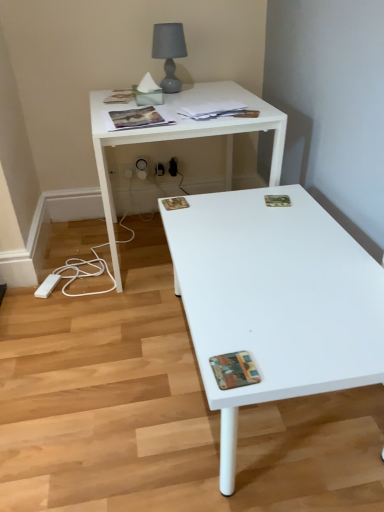
Question: Should I look upward or downward to see multicolored textured magazine at lower right, positioned as the 1th magazine in bottom-to-top order?

Choices:
 (A) up
 (B) down

Answer: (B)

Question: Is multicolored textured magazine at lower right, which ranks as the 6th magazine in back-to-front order, touching printed paper magazine at center, marked as the second magazine in a bottom-to-top arrangement?

Choices:
 (A) no
 (B) yes

Answer: (A)

Question: Can you confirm if multicolored textured magazine at lower right, acting as the first magazine starting from the front, is bigger than printed paper magazine at center, acting as the 3th magazine starting from the front?

Choices:
 (A) no
 (B) yes

Answer: (B)

Question: Does multicolored textured magazine at lower right, acting as the first magazine starting from the front, turn towards printed paper magazine at center, marked as the second magazine in a bottom-to-top arrangement?

Choices:
 (A) no
 (B) yes

Answer: (A)

Question: From a real-world perspective, is multicolored textured magazine at lower right, positioned as the 1th magazine in bottom-to-top order, beneath printed paper magazine at center, acting as the 3th magazine starting from the front?

Choices:
 (A) no
 (B) yes

Answer: (A)

Question: Is multicolored textured magazine at lower right, which ranks as the 6th magazine in back-to-front order, to the right of printed paper magazine at center, marked as the second magazine in a bottom-to-top arrangement, from the viewer's perspective?

Choices:
 (A) no
 (B) yes

Answer: (B)

Question: Is multicolored textured magazine at lower right, which ranks as the 6th magazine in back-to-front order, smaller than printed paper magazine at center, acting as the 3th magazine starting from the front?

Choices:
 (A) no
 (B) yes

Answer: (A)

Question: Is white plastic electric outlet at lower center, which is counted as the first electric outlet, starting from the left, in contact with printed paper magazine at upper center, which appears as the second magazine when viewed from the front?

Choices:
 (A) no
 (B) yes

Answer: (A)

Question: Is white plastic electric outlet at lower center, the second electric outlet positioned from the right, thinner than printed paper magazine at upper center, the third magazine positioned from the top?

Choices:
 (A) no
 (B) yes

Answer: (B)

Question: From a real-world perspective, is white plastic electric outlet at lower center, which is counted as the first electric outlet, starting from the left, below printed paper magazine at upper center, the third magazine positioned from the top?

Choices:
 (A) no
 (B) yes

Answer: (B)

Question: From the image's perspective, does white plastic electric outlet at lower center, which is counted as the first electric outlet, starting from the left, appear lower than printed paper magazine at upper center, the 5th magazine when ordered from back to front?

Choices:
 (A) yes
 (B) no

Answer: (A)

Question: Would you say white plastic electric outlet at lower center, which is counted as the first electric outlet, starting from the left, contains printed paper magazine at upper center, the 5th magazine when ordered from back to front?

Choices:
 (A) no
 (B) yes

Answer: (A)

Question: Does white plastic electric outlet at lower center, which is counted as the first electric outlet, starting from the left, have a smaller size compared to printed paper magazine at upper center, the 5th magazine when ordered from back to front?

Choices:
 (A) no
 (B) yes

Answer: (B)

Question: From a real-world perspective, is matte paper magazine at upper center, the fourth magazine when ordered from front to back, on camouflage paper magazine at upper right, the fourth magazine in the top-to-bottom sequence?

Choices:
 (A) yes
 (B) no

Answer: (A)